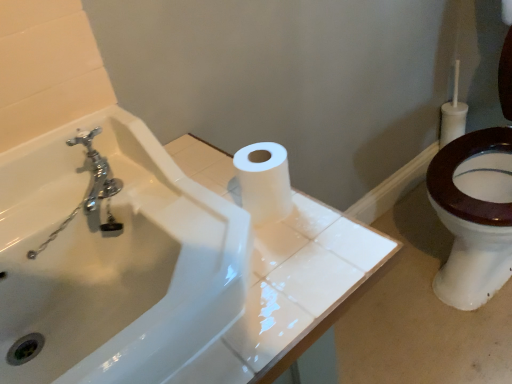
Identify the location of free space in front of white matte toilet paper at center. (289, 272).